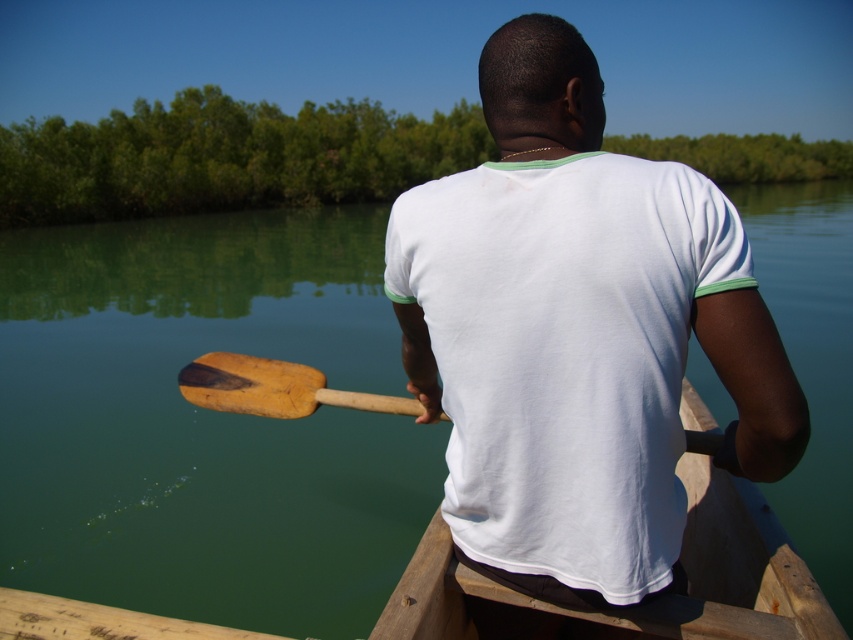
Question: Which point appears closest to the camera in this image?

Choices:
 (A) (x=746, y=483)
 (B) (x=251, y=360)
 (C) (x=751, y=454)
 (D) (x=422, y=429)

Answer: (C)

Question: In this image, where is white cotton shirt at center located relative to wooden paddle at center?

Choices:
 (A) left
 (B) right

Answer: (B)

Question: Which of the following is the farthest from the observer?

Choices:
 (A) wooden canoe at center
 (B) white cotton shirt at center

Answer: (A)

Question: Which of the following is the closest to the observer?

Choices:
 (A) wooden canoe at center
 (B) green smooth water at center
 (C) wooden paddle at center
 (D) white cotton shirt at center

Answer: (D)

Question: Is white cotton shirt at center to the left of wooden canoe at center from the viewer's perspective?

Choices:
 (A) yes
 (B) no

Answer: (A)

Question: Is green smooth water at center behind white cotton shirt at center?

Choices:
 (A) yes
 (B) no

Answer: (A)